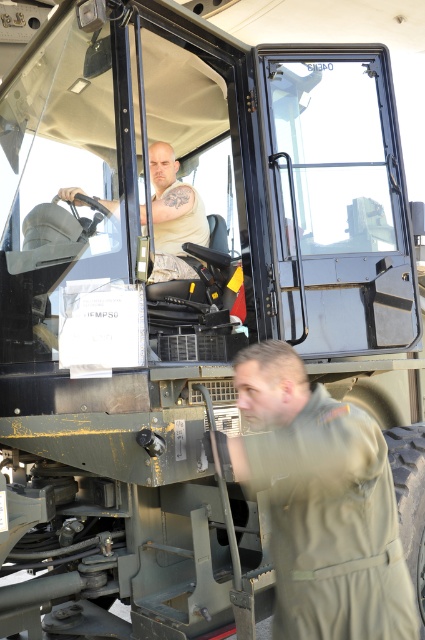
You are a military observer trying to identify the positions of two soldiers in the scene. Which soldier is closer to you, the olive green uniform at lower right or the matte khaki uniform at center?

The olive green uniform at lower right is closer to you because it is positioned in front of the matte khaki uniform at center.

You are standing in front of the military vehicle and want to determine which of the two points, point (280, 342) or point (173, 256), is nearer to you. Based on the scene description, which point is closer?

Point (280, 342) is closer to the viewer than point (173, 256).